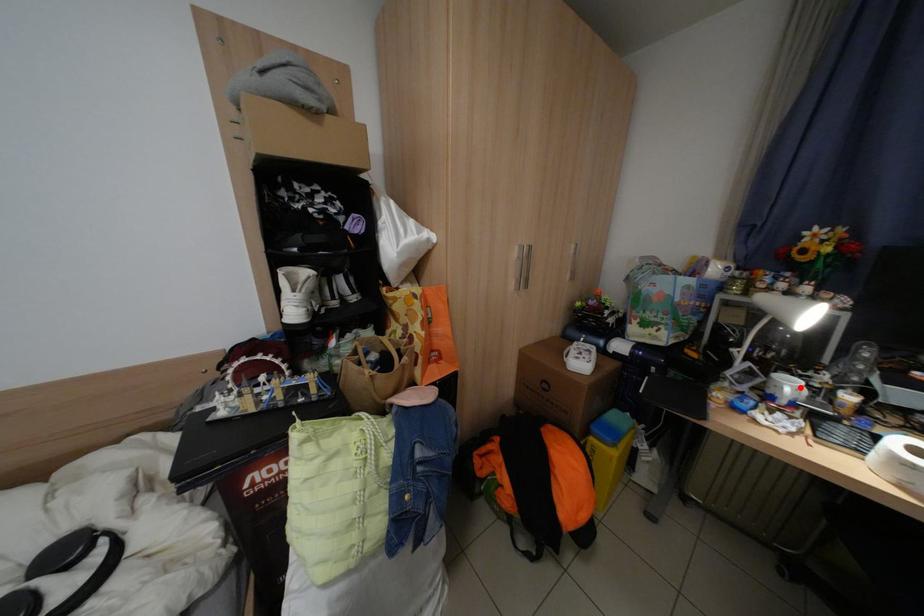
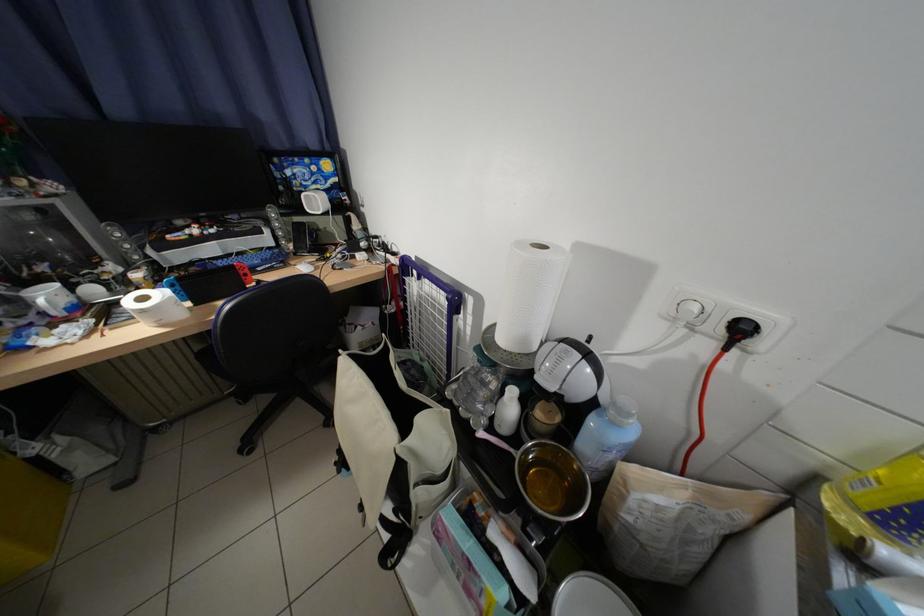
Find the pixel in the second image that matches the highlighted location in the first image.

(59, 297)